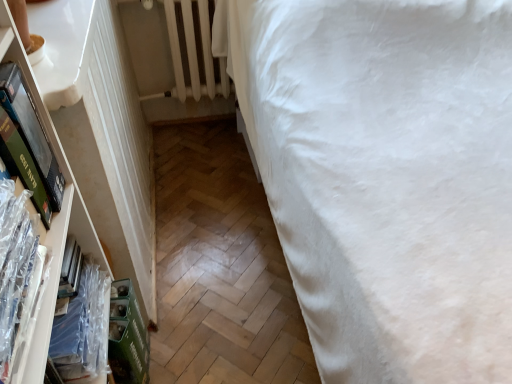
Measure the distance between white cotton bed at right and camera.

The depth of white cotton bed at right is 27.48 inches.

Measure the distance between point (32, 305) and camera.

27.20 inches.

Identify the location of white cotton bed at right. The height and width of the screenshot is (384, 512). (386, 176).

How much distance is there between clear plastic book at left, which is the 2th book in front-to-back order, and green matte book at left?

11.81 inches.

Which is more distant, (71, 314) or (50, 178)?

The point (71, 314) is more distant.

Looking at this image, could you tell me if clear plastic book at left, which ranks as the 1th book in back-to-front order, is facing green matte book at left?

No, clear plastic book at left, which ranks as the 1th book in back-to-front order, is not turned towards green matte book at left.

Is clear plastic book at left, which ranks as the 1th book in back-to-front order, far from green matte book at left?

No, clear plastic book at left, which ranks as the 1th book in back-to-front order, is in close proximity to green matte book at left.

Based on the photo, can you tell me how much white cotton bed at right and green matte book at left differ in facing direction?

There is a 83.7-degree angle between the facing directions of white cotton bed at right and green matte book at left.

Between white cotton bed at right and green matte book at left, which one has larger width?

Wider between the two is white cotton bed at right.

Is green matte book at left at the back of white cotton bed at right?

No.

From a real-world perspective, who is located higher, white cotton bed at right or green matte book at left?

green matte book at left.

Is the position of white painted metal radiator at upper left less distant than that of white cotton bed at right?

No, it is behind white cotton bed at right.

From a real-world perspective, does white painted metal radiator at upper left stand above white cotton bed at right?

Correct, in the physical world, white painted metal radiator at upper left is higher than white cotton bed at right.

Can you confirm if white painted metal radiator at upper left is bigger than white cotton bed at right?

No, white painted metal radiator at upper left is not bigger than white cotton bed at right.

Is white cotton bed at right beside clear plastic book at left, the 1th book viewed from the front?

white cotton bed at right and clear plastic book at left, the 1th book viewed from the front, are not in contact.

From the image's perspective, is white cotton bed at right above clear plastic book at left, the 1th book viewed from the front?

Yes, from the image's perspective, white cotton bed at right is on top of clear plastic book at left, the 1th book viewed from the front.

From a real-world perspective, is white cotton bed at right under clear plastic book at left, arranged as the second book when viewed from the back?

Yes, from a real-world perspective, white cotton bed at right is beneath clear plastic book at left, arranged as the second book when viewed from the back.

How distant is white cotton bed at right from clear plastic book at left, the 1th book viewed from the front?

white cotton bed at right is 39.15 inches away from clear plastic book at left, the 1th book viewed from the front.

Between clear plastic book at left, arranged as the second book when viewed from the back, and green matte book at left, which one has smaller size?

With smaller size is clear plastic book at left, arranged as the second book when viewed from the back.

Is green matte book at left at the back of clear plastic book at left, the 1th book viewed from the front?

No.

Is point (27, 211) less distant than point (33, 135)?

Yes, point (27, 211) is in front of point (33, 135).

Considering the relative positions of clear plastic book at left, the 1th book viewed from the front, and green matte book at left in the image provided, is clear plastic book at left, the 1th book viewed from the front, to the left or to the right of green matte book at left?

clear plastic book at left, the 1th book viewed from the front, is to the right of green matte book at left.

Considering the sizes of clear plastic book at left, arranged as the second book when viewed from the back, and clear plastic book at left, which ranks as the 1th book in back-to-front order, in the image, is clear plastic book at left, arranged as the second book when viewed from the back, wider or thinner than clear plastic book at left, which ranks as the 1th book in back-to-front order,?

In the image, clear plastic book at left, arranged as the second book when viewed from the back, appears to be more narrow than clear plastic book at left, which ranks as the 1th book in back-to-front order.

Does point (6, 181) appear closer or farther from the camera than point (81, 376)?

Point (6, 181).

Is clear plastic book at left, arranged as the second book when viewed from the back, directly adjacent to clear plastic book at left, which is the 2th book in front-to-back order?

clear plastic book at left, arranged as the second book when viewed from the back, and clear plastic book at left, which is the 2th book in front-to-back order, are not in contact.

Considering the sizes of white painted metal radiator at upper left and clear plastic book at left, which is the 2th book in front-to-back order, in the image, is white painted metal radiator at upper left bigger or smaller than clear plastic book at left, which is the 2th book in front-to-back order,?

In the image, white painted metal radiator at upper left appears to be larger than clear plastic book at left, which is the 2th book in front-to-back order.

Locate an element on the screen. book below the white painted metal radiator at upper left (from a real-world perspective) is located at coordinates (83, 328).

Between white painted metal radiator at upper left and clear plastic book at left, which ranks as the 1th book in back-to-front order, which one has smaller width?

With smaller width is white painted metal radiator at upper left.

Is clear plastic book at left, which ranks as the 1th book in back-to-front order, completely or partially inside white painted metal radiator at upper left?

No, clear plastic book at left, which ranks as the 1th book in back-to-front order, is not a part of white painted metal radiator at upper left.

You are a GUI agent. You are given a task and a screenshot of the screen. Output one action in this format:
    pyautogui.click(x=<x>, y=<y>)
    Task: Click on the paperback book located above the clear plastic book at left, which is the 2th book in front-to-back order (from a real-world perspective)
    
    Given the screenshot: What is the action you would take?
    pyautogui.click(x=32, y=138)

The height and width of the screenshot is (384, 512). In the image, there is a green matte book at left. Identify the location of bed below it (from a real-world perspective). (386, 176).

Which object lies further to the anchor point clear plastic book at left, the 1th book viewed from the front, green matte book at left or white cotton bed at right?

white cotton bed at right is further to clear plastic book at left, the 1th book viewed from the front.

When comparing their distances from clear plastic book at left, which is the 2th book in front-to-back order, does green matte book at left or white painted metal radiator at upper left seem closer?

green matte book at left is positioned closer to the anchor clear plastic book at left, which is the 2th book in front-to-back order.

Looking at the image, which one is located closer to clear plastic book at left, which is the 2th book in front-to-back order, clear plastic book at left, the 1th book viewed from the front, or white painted metal radiator at upper left?

clear plastic book at left, the 1th book viewed from the front.

When comparing their distances from clear plastic book at left, arranged as the second book when viewed from the back, does white painted metal radiator at upper left or white cotton bed at right seem closer?

The object closer to clear plastic book at left, arranged as the second book when viewed from the back, is white cotton bed at right.

Looking at the image, which one is located further to clear plastic book at left, arranged as the second book when viewed from the back, clear plastic book at left, which is the 2th book in front-to-back order, or green matte book at left?

Based on the image, clear plastic book at left, which is the 2th book in front-to-back order, appears to be further to clear plastic book at left, arranged as the second book when viewed from the back.

Estimate the real-world distances between objects in this image. Which object is further from clear plastic book at left, arranged as the second book when viewed from the back, white painted metal radiator at upper left or green matte book at left?

Based on the image, white painted metal radiator at upper left appears to be further to clear plastic book at left, arranged as the second book when viewed from the back.

Based on the photo, considering their positions, is clear plastic book at left, which ranks as the 1th book in back-to-front order, positioned further to white cotton bed at right than green matte book at left?

The object further to white cotton bed at right is green matte book at left.

From the image, which object appears to be farther from clear plastic book at left, which ranks as the 1th book in back-to-front order, white painted metal radiator at upper left or clear plastic book at left, arranged as the second book when viewed from the back?

white painted metal radiator at upper left is positioned further to the anchor clear plastic book at left, which ranks as the 1th book in back-to-front order.

Find the location of a particular element. The image size is (512, 384). book between clear plastic book at left, which ranks as the 1th book in back-to-front order, and white cotton bed at right, in the horizontal direction is located at coordinates (16, 272).

Image resolution: width=512 pixels, height=384 pixels. In order to click on paperback book between clear plastic book at left, the 1th book viewed from the front, and clear plastic book at left, which is the 2th book in front-to-back order, from front to back in this screenshot , I will do `click(32, 138)`.

This screenshot has width=512, height=384. I want to click on paperback book between white cotton bed at right and white painted metal radiator at upper left from front to back, so click(32, 138).

The height and width of the screenshot is (384, 512). In order to click on book located between clear plastic book at left, arranged as the second book when viewed from the back, and white painted metal radiator at upper left in the depth direction in this screenshot , I will do `click(83, 328)`.